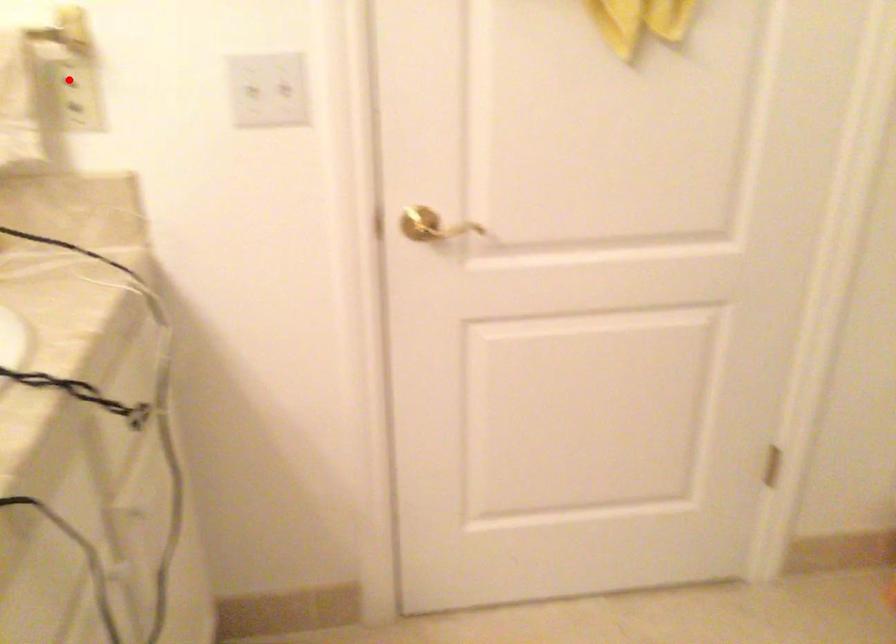
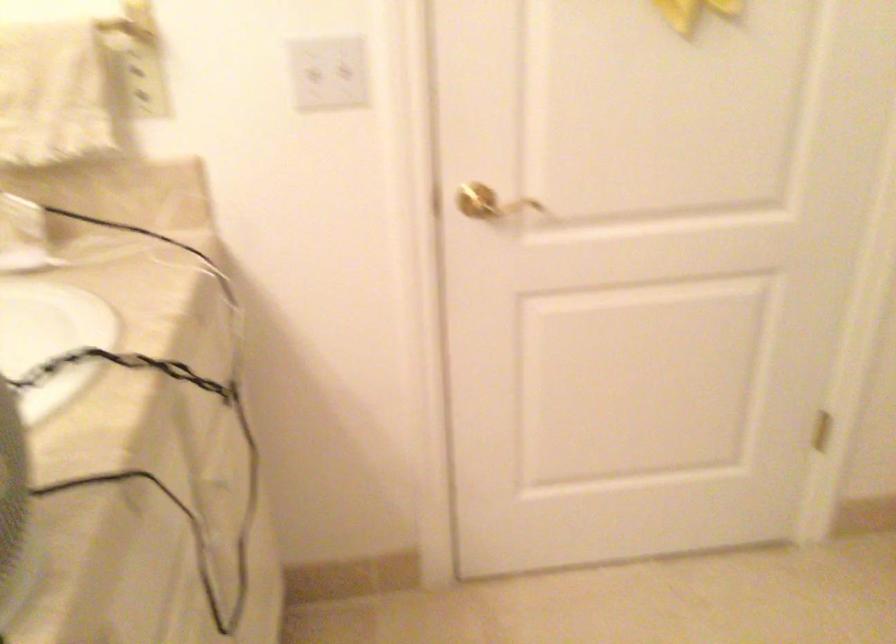
Locate, in the second image, the point that corresponds to the highlighted location in the first image.

(136, 69)